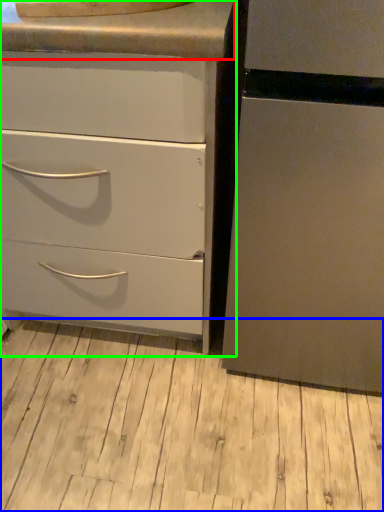
Question: Which object is the farthest from counter top (highlighted by a red box)? Choose among these: plank (highlighted by a blue box) or chest of drawers (highlighted by a green box).

Choices:
 (A) plank
 (B) chest of drawers

Answer: (A)